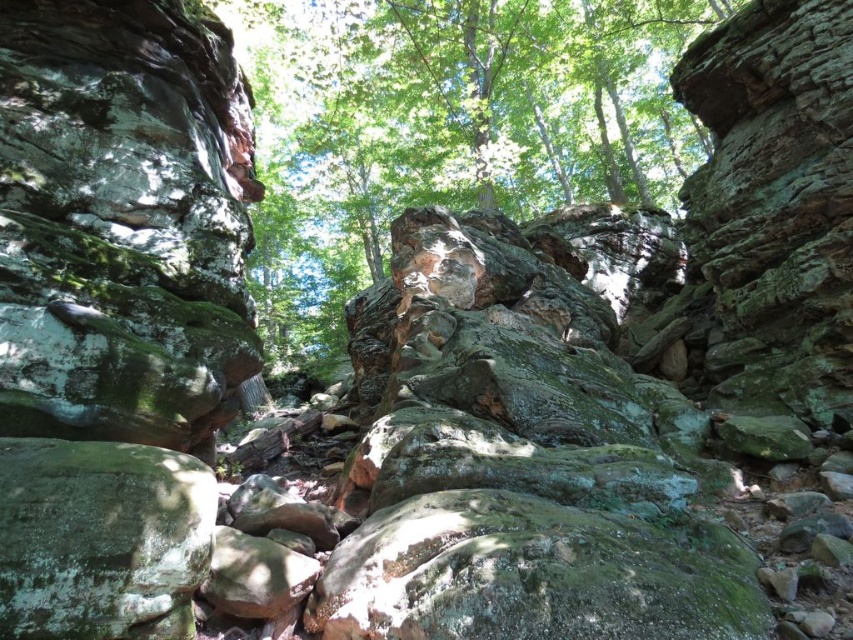
You are a hiker trying to navigate through the rocks. You see the green mossy rock at center and the green mossy rock at lower left. Which rock should you avoid stepping on if you want to avoid the tallest one?

You should avoid stepping on the green mossy rock at center because it is much taller than the green mossy rock at lower left.

You are standing in the natural scene and want to reach the green mossy rock at lower left. Which direction should you move relative to the green mossy rock at center?

To reach the green mossy rock at lower left, you should move behind the green mossy rock at center since the green mossy rock at lower left is positioned behind it.